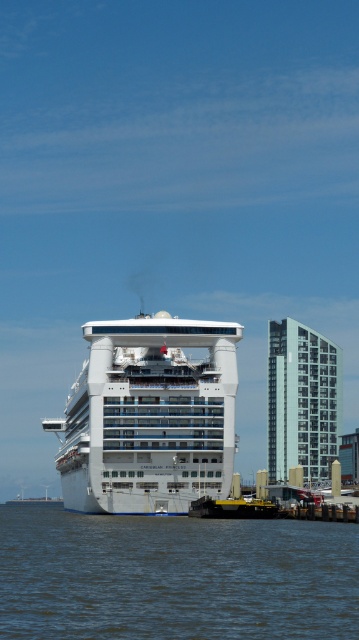
You are a photographer standing on the pier. You want to take a photo of the white glossy cruise ship at center and the brown water at lower left. Which object will occupy more horizontal space in your photo?

The brown water at lower left will occupy more horizontal space in the photo because its width surpasses that of the white glossy cruise ship at center according to the description.

You are a photographer standing on the pier and want to take a photo of the white glossy cruise ship at center. However, there is brown water at lower left in your viewfinder. Which object in your viewfinder is taller?

The white glossy cruise ship at center is taller than the brown water at lower left.

You are a passenger on the cruise ship and want to see the water near the shore. From your position on the white glossy cruise ship at center, which direction should you look to see the brown water at lower left?

The brown water at lower left is positioned under the white glossy cruise ship at center, so you should look downward from the ship to see the brown water at lower left.